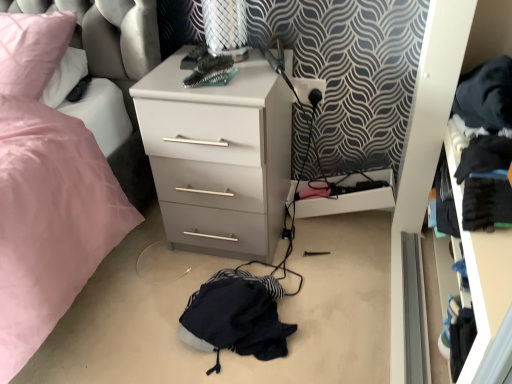
You are a GUI agent. You are given a task and a screenshot of the screen. Output one action in this format:
    pyautogui.click(x=<x>, y=<y>)
    Task: Click on the free space between black fabric drawer at right and dark blue fabric at center
    The height and width of the screenshot is (384, 512).
    Given the screenshot: What is the action you would take?
    click(345, 306)